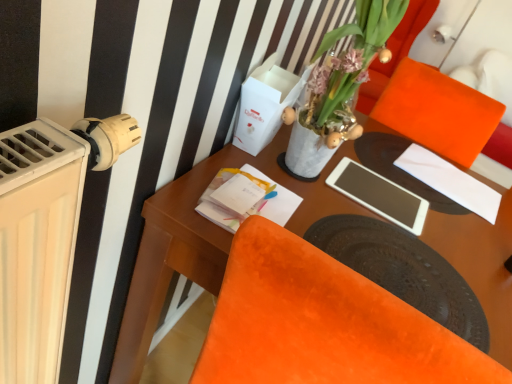
This screenshot has width=512, height=384. I want to click on white matte tablet at center, so click(x=379, y=195).

In order to face translucent glass vase at upper center, should I rotate leftwards or rightwards?

Rotate right and turn 11.551 degrees.

Image resolution: width=512 pixels, height=384 pixels. What are the coordinates of `white paper at upper right` in the screenshot? It's located at (450, 181).

Find the location of a particular element. The height and width of the screenshot is (384, 512). orange velvet armchair at upper right is located at coordinates (438, 111).

Is there a large distance between velvet orange chair at lower right and translucent glass vase at upper center?

That's not correct — velvet orange chair at lower right is a little close to translucent glass vase at upper center.

Between velvet orange chair at lower right and translucent glass vase at upper center, which one appears on the left side from the viewer's perspective?

From the viewer's perspective, translucent glass vase at upper center appears more on the left side.

Is point (241, 232) positioned after point (351, 139)?

That is False.

There is a velvet orange chair at lower right. Where is `houseplant above it (from a real-world perspective)`? The image size is (512, 384). houseplant above it (from a real-world perspective) is located at coordinates (338, 89).

Are translucent glass vase at upper center and wooden desk at center beside each other?

No, translucent glass vase at upper center is not next to wooden desk at center.

Who is smaller, translucent glass vase at upper center or wooden desk at center?

translucent glass vase at upper center is smaller.

Which object is wider, translucent glass vase at upper center or wooden desk at center?

wooden desk at center is wider.

From the image's perspective, which one is positioned lower, translucent glass vase at upper center or wooden desk at center?

From the image's view, wooden desk at center is below.

In the image, is velvet orange chair at lower right on the left side or the right side of white matte tablet at center?

velvet orange chair at lower right is positioned on white matte tablet at center's right side.

From the image's perspective, would you say velvet orange chair at lower right is shown under white matte tablet at center?

Yes.

Considering the positions of points (476, 373) and (343, 169), is point (476, 373) closer to camera compared to point (343, 169)?

Yes, it is.

At what (x,y) coordinates should I click in order to perform the action: click on chair that appears on the right of white matte tablet at center. Please return your answer as a coordinate pair (x, y). This screenshot has height=384, width=512. Looking at the image, I should click on (323, 323).

Could you tell me if wooden desk at center is facing velvet orange chair at lower right?

No, wooden desk at center is not oriented towards velvet orange chair at lower right.

This screenshot has width=512, height=384. Find the location of `desk lying below the velvet orange chair at lower right (from the image's perspective)`. desk lying below the velvet orange chair at lower right (from the image's perspective) is located at coordinates (203, 241).

Is wooden desk at center further to the viewer compared to velvet orange chair at lower right?

That is False.

The height and width of the screenshot is (384, 512). In order to click on tablet computer on the left of orange velvet armchair at upper right in this screenshot , I will do `click(379, 195)`.

Considering the positions of objects orange velvet armchair at upper right and white matte tablet at center in the image provided, who is more to the right, orange velvet armchair at upper right or white matte tablet at center?

Positioned to the right is orange velvet armchair at upper right.

Would you say orange velvet armchair at upper right is inside or outside white matte tablet at center?

orange velvet armchair at upper right lies outside white matte tablet at center.

Between point (493, 110) and point (393, 221), which one is positioned behind?

Point (493, 110)

Which is correct: orange velvet armchair at upper right is inside velvet orange chair at lower right, or outside of it?

orange velvet armchair at upper right is not inside velvet orange chair at lower right, it's outside.

Is orange velvet armchair at upper right closer to camera compared to velvet orange chair at lower right?

No, it is not.

Are orange velvet armchair at upper right and velvet orange chair at lower right making contact?

No.

Can you confirm if translucent glass vase at upper center is positioned to the left of white matte tablet at center?

Yes.

Does point (327, 81) come in front of point (365, 185)?

That is True.

Is white matte tablet at center at the back of translucent glass vase at upper center?

No, translucent glass vase at upper center's orientation is not away from white matte tablet at center.

Consider the image. From the image's perspective, which one is positioned lower, translucent glass vase at upper center or white matte tablet at center?

From the image's view, white matte tablet at center is below.

Find the location of a particular element. houseplant above the velvet orange chair at lower right (from a real-world perspective) is located at coordinates (338, 89).

What are the coordinates of `desk that is on the right side of translucent glass vase at upper center` in the screenshot? It's located at (203, 241).

Estimate the real-world distances between objects in this image. Which object is closer to white paper at upper right, orange velvet armchair at upper right or wooden desk at center?

orange velvet armchair at upper right is positioned closer to the anchor white paper at upper right.

Looking at the image, which one is located closer to orange velvet armchair at upper right, white matte tablet at center or translucent glass vase at upper center?

Based on the image, white matte tablet at center appears to be nearer to orange velvet armchair at upper right.

Based on the photo, estimate the real-world distances between objects in this image. Which object is closer to white paper at upper right, translucent glass vase at upper center or orange velvet armchair at upper right?

orange velvet armchair at upper right is closer to white paper at upper right.

Based on the photo, looking at the image, which one is located further to velvet orange chair at lower right, orange velvet armchair at upper right or white matte tablet at center?

Based on the image, orange velvet armchair at upper right appears to be further to velvet orange chair at lower right.

Which object lies further to the anchor point white matte tablet at center, wooden desk at center or white paper at upper right?

The object further to white matte tablet at center is white paper at upper right.

Looking at the image, which one is located further to orange velvet armchair at upper right, wooden desk at center or white matte tablet at center?

The object further to orange velvet armchair at upper right is wooden desk at center.

Which object lies further to the anchor point orange velvet armchair at upper right, translucent glass vase at upper center or white paper at upper right?

translucent glass vase at upper center lies further to orange velvet armchair at upper right than the other object.

Looking at the image, which one is located further to white matte tablet at center, wooden desk at center or velvet orange chair at lower right?

velvet orange chair at lower right is further to white matte tablet at center.

Identify the location of tablet computer between translucent glass vase at upper center and white paper at upper right. This screenshot has width=512, height=384. (379, 195).

Identify the location of tablet computer between translucent glass vase at upper center and orange velvet armchair at upper right along the z-axis. (379, 195).

Where is `houseplant between wooden desk at center and orange velvet armchair at upper right from front to back`? The image size is (512, 384). houseplant between wooden desk at center and orange velvet armchair at upper right from front to back is located at coordinates (338, 89).

You are a GUI agent. You are given a task and a screenshot of the screen. Output one action in this format:
    pyautogui.click(x=<x>, y=<y>)
    Task: Click on the notepad located between wooden desk at center and orange velvet armchair at upper right in the depth direction
    This screenshot has width=512, height=384.
    Given the screenshot: What is the action you would take?
    pyautogui.click(x=450, y=181)